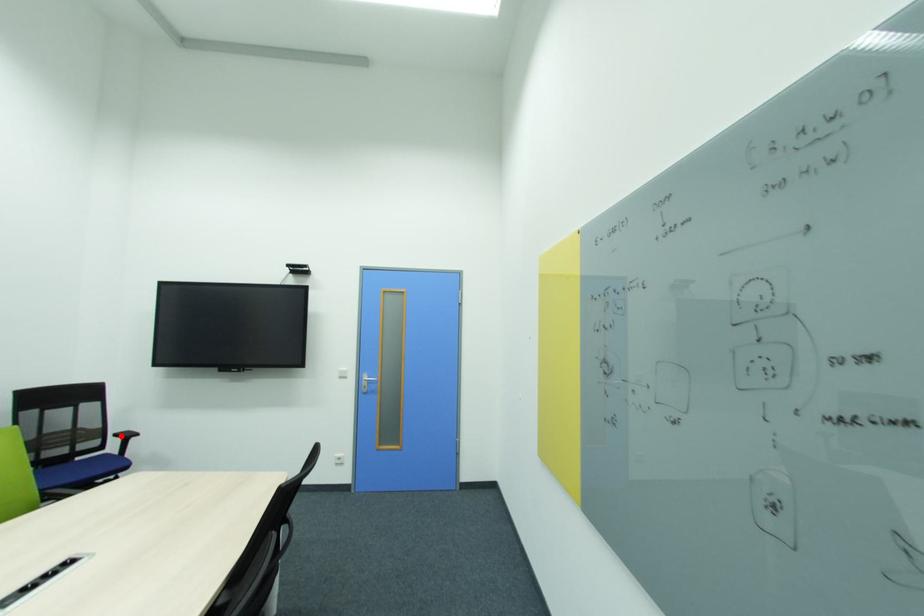
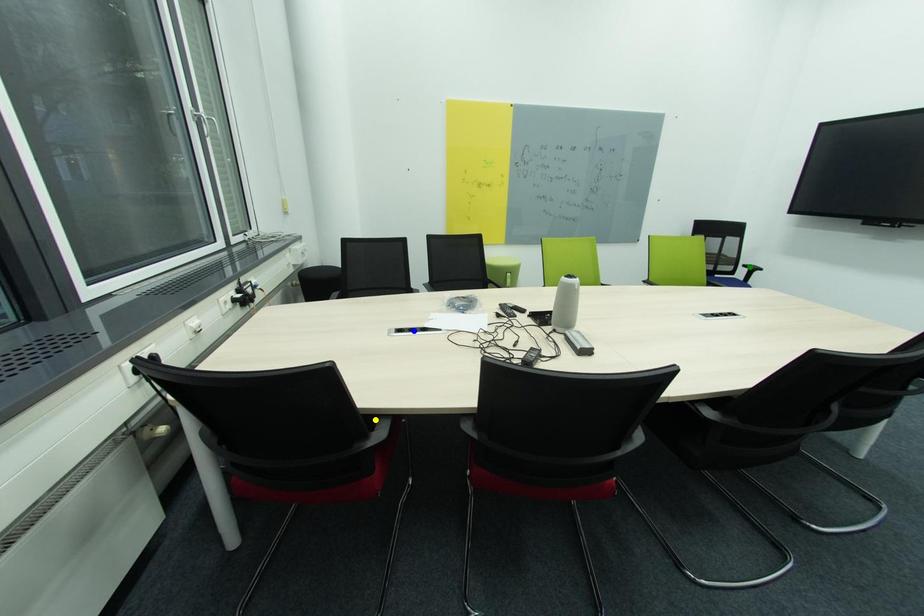
Question: I am providing you with two images of the same scene from different viewpoints. A red point is marked on the first image. You are given multiple points on the second image. Which mark in image 2 goes with the point in image 1?

Choices:
 (A) green point
 (B) blue point
 (C) yellow point

Answer: (A)